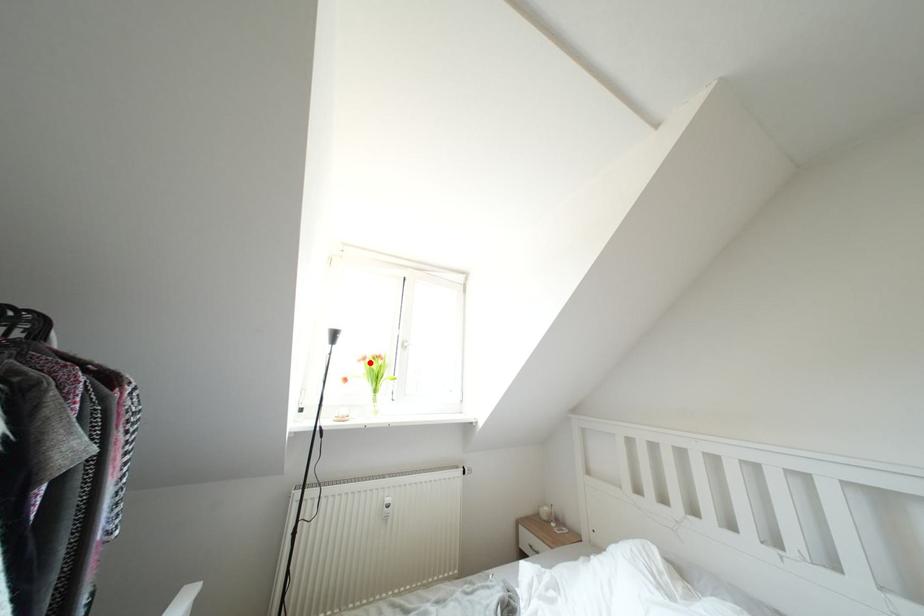
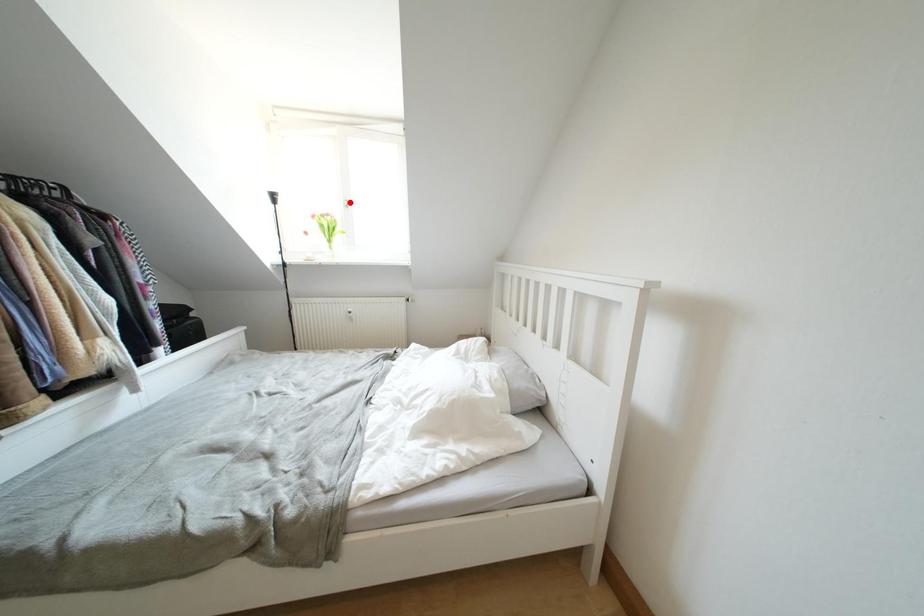
I am providing you with two images of the same scene from different viewpoints. A red point is marked on the first image and another point is marked on the second image. Does the point marked in image1 correspond to the same location as the one in image2?

No